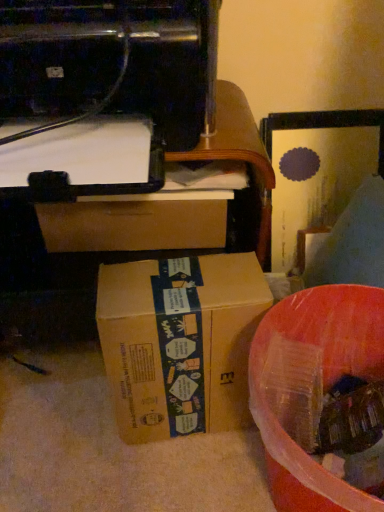
Question: From a real-world perspective, is black plastic printer at upper left beneath translucent plastic container at lower right?

Choices:
 (A) yes
 (B) no

Answer: (B)

Question: From the image's perspective, would you say black plastic printer at upper left is shown under translucent plastic container at lower right?

Choices:
 (A) no
 (B) yes

Answer: (A)

Question: Would you say black plastic printer at upper left is outside translucent plastic container at lower right?

Choices:
 (A) yes
 (B) no

Answer: (A)

Question: Does black plastic printer at upper left contain translucent plastic container at lower right?

Choices:
 (A) yes
 (B) no

Answer: (B)

Question: Is black plastic printer at upper left smaller than translucent plastic container at lower right?

Choices:
 (A) yes
 (B) no

Answer: (B)

Question: In terms of size, does translucent plastic container at lower right appear bigger or smaller than brown cardboard box at center?

Choices:
 (A) small
 (B) big

Answer: (B)

Question: From a real-world perspective, is translucent plastic container at lower right physically located above or below brown cardboard box at center?

Choices:
 (A) above
 (B) below

Answer: (B)

Question: Considering their positions, is translucent plastic container at lower right located in front of or behind brown cardboard box at center?

Choices:
 (A) front
 (B) behind

Answer: (A)

Question: Is translucent plastic container at lower right inside or outside of brown cardboard box at center?

Choices:
 (A) outside
 (B) inside

Answer: (A)

Question: From the image's perspective, is black plastic printer at upper left above or below brown cardboard box at center?

Choices:
 (A) above
 (B) below

Answer: (A)

Question: Looking at their shapes, would you say black plastic printer at upper left is wider or thinner than brown cardboard box at center?

Choices:
 (A) wide
 (B) thin

Answer: (A)

Question: In terms of size, does black plastic printer at upper left appear bigger or smaller than brown cardboard box at center?

Choices:
 (A) small
 (B) big

Answer: (B)

Question: In terms of height, does black plastic printer at upper left look taller or shorter compared to brown cardboard box at center?

Choices:
 (A) short
 (B) tall

Answer: (A)

Question: Is brown cardboard box at center bigger or smaller than black plastic printer at upper left?

Choices:
 (A) small
 (B) big

Answer: (A)

Question: Is brown cardboard box at center taller or shorter than black plastic printer at upper left?

Choices:
 (A) tall
 (B) short

Answer: (A)